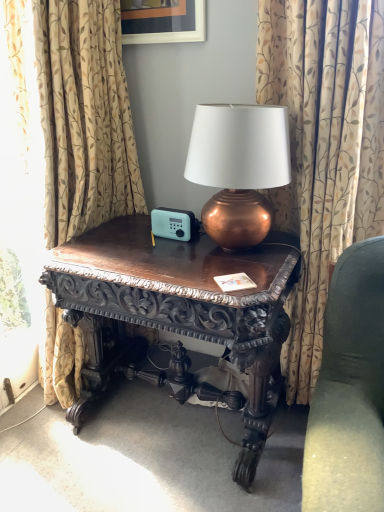
Image resolution: width=384 pixels, height=512 pixels. Describe the element at coordinates (239, 168) in the screenshot. I see `copper metallic lamp at center` at that location.

This screenshot has height=512, width=384. What do you see at coordinates (181, 305) in the screenshot?
I see `dark wood carved table at center` at bounding box center [181, 305].

This screenshot has width=384, height=512. I want to click on matte black picture frame at upper center, so click(x=163, y=21).

Which point is more distant from viewer, (358, 342) or (201, 27)?

The point (201, 27) is farther from the camera.

Which object is positioned more to the right, velvet green couch at right or matte black picture frame at upper center?

From the viewer's perspective, velvet green couch at right appears more on the right side.

Is velvet green couch at right oriented towards matte black picture frame at upper center?

No.

Does velvet green couch at right come in front of matte black picture frame at upper center?

Yes, velvet green couch at right is closer to the camera.

Which of these two, dark wood carved table at center or copper metallic lamp at center, stands taller?

With more height is dark wood carved table at center.

Which object is closer to the camera taking this photo, dark wood carved table at center or copper metallic lamp at center?

dark wood carved table at center is closer to the camera.

In the image, is dark wood carved table at center on the left side or the right side of copper metallic lamp at center?

dark wood carved table at center is positioned on copper metallic lamp at center's left side.

Between dark wood carved table at center and copper metallic lamp at center, which one has larger width?

dark wood carved table at center.

In the image, there is a copper metallic lamp at center. Identify the location of picture frame above it (from the image's perspective). The height and width of the screenshot is (512, 384). (163, 21).

Which object is positioned more to the left, copper metallic lamp at center or matte black picture frame at upper center?

Positioned to the left is matte black picture frame at upper center.

Considering the sizes of objects copper metallic lamp at center and matte black picture frame at upper center in the image provided, who is thinner, copper metallic lamp at center or matte black picture frame at upper center?

With smaller width is matte black picture frame at upper center.

Can you confirm if copper metallic lamp at center is taller than matte black picture frame at upper center?

Correct, copper metallic lamp at center is much taller as matte black picture frame at upper center.

Between matte black picture frame at upper center and copper metallic lamp at center, which one is positioned behind?

matte black picture frame at upper center is more distant.

Is matte black picture frame at upper center facing towards copper metallic lamp at center?

No, matte black picture frame at upper center is not aimed at copper metallic lamp at center.

Can you confirm if matte black picture frame at upper center is shorter than copper metallic lamp at center?

Correct, matte black picture frame at upper center is not as tall as copper metallic lamp at center.

In the image, there is a matte black picture frame at upper center. Identify the location of lamp below it (from the image's perspective). (239, 168).

Measure the distance from patterned fabric curtain at center, the second curtain when ordered from left to right, to dark wood carved table at center.

A distance of 16.06 inches exists between patterned fabric curtain at center, the second curtain when ordered from left to right, and dark wood carved table at center.

Is patterned fabric curtain at center, the 1th curtain in the right-to-left sequence, not close to dark wood carved table at center?

That's not correct — patterned fabric curtain at center, the 1th curtain in the right-to-left sequence, is a little close to dark wood carved table at center.

Is patterned fabric curtain at center, the 1th curtain in the right-to-left sequence, oriented away from dark wood carved table at center?

No, dark wood carved table at center is not at the back of patterned fabric curtain at center, the 1th curtain in the right-to-left sequence.

Considering the relative sizes of patterned fabric curtain at center, the second curtain when ordered from left to right, and dark wood carved table at center in the image provided, is patterned fabric curtain at center, the second curtain when ordered from left to right, bigger than dark wood carved table at center?

No, patterned fabric curtain at center, the second curtain when ordered from left to right, is not bigger than dark wood carved table at center.

Looking at this image, is beige floral fabric curtain at left, which appears as the 1th curtain when viewed from the left, touching copper metallic lamp at center?

beige floral fabric curtain at left, which appears as the 1th curtain when viewed from the left, and copper metallic lamp at center are not in contact.

From the image's perspective, is beige floral fabric curtain at left, acting as the second curtain starting from the right, above copper metallic lamp at center?

Actually, beige floral fabric curtain at left, acting as the second curtain starting from the right, appears below copper metallic lamp at center in the image.

Consider the image. Is beige floral fabric curtain at left, acting as the second curtain starting from the right, aimed at copper metallic lamp at center?

Yes, beige floral fabric curtain at left, acting as the second curtain starting from the right, is oriented towards copper metallic lamp at center.

Can you confirm if beige floral fabric curtain at left, acting as the second curtain starting from the right, is wider than copper metallic lamp at center?

No.

In the scene shown: Is patterned fabric curtain at center, the 1th curtain in the right-to-left sequence, not close to velvet green couch at right?

patterned fabric curtain at center, the 1th curtain in the right-to-left sequence, is near velvet green couch at right, not far away.

Considering the relative positions of patterned fabric curtain at center, the 1th curtain in the right-to-left sequence, and velvet green couch at right in the image provided, is patterned fabric curtain at center, the 1th curtain in the right-to-left sequence, in front of velvet green couch at right?

No, the depth of patterned fabric curtain at center, the 1th curtain in the right-to-left sequence, is greater than that of velvet green couch at right.

Considering the relative positions of patterned fabric curtain at center, the second curtain when ordered from left to right, and velvet green couch at right in the image provided, is patterned fabric curtain at center, the second curtain when ordered from left to right, to the left of velvet green couch at right from the viewer's perspective?

Correct, you'll find patterned fabric curtain at center, the second curtain when ordered from left to right, to the left of velvet green couch at right.

Considering the sizes of objects patterned fabric curtain at center, the 1th curtain in the right-to-left sequence, and velvet green couch at right in the image provided, who is bigger, patterned fabric curtain at center, the 1th curtain in the right-to-left sequence, or velvet green couch at right?

velvet green couch at right is bigger.

The width and height of the screenshot is (384, 512). What are the coordinates of `studio couch that appears below the matte black picture frame at upper center (from the image's perspective)` in the screenshot? It's located at (349, 390).

Locate an element on the screen. The width and height of the screenshot is (384, 512). lamp behind the dark wood carved table at center is located at coordinates (239, 168).

From the image, which object appears to be farther from velvet green couch at right, matte black picture frame at upper center or beige floral fabric curtain at left, which appears as the 1th curtain when viewed from the left?

matte black picture frame at upper center is further to velvet green couch at right.

Estimate the real-world distances between objects in this image. Which object is further from copper metallic lamp at center, dark wood carved table at center or matte black picture frame at upper center?

matte black picture frame at upper center.

Which object lies nearer to the anchor point patterned fabric curtain at center, the second curtain when ordered from left to right, velvet green couch at right or beige floral fabric curtain at left, which appears as the 1th curtain when viewed from the left?

Based on the image, velvet green couch at right appears to be nearer to patterned fabric curtain at center, the second curtain when ordered from left to right.

Considering their positions, is patterned fabric curtain at center, the 1th curtain in the right-to-left sequence, positioned further to matte black picture frame at upper center than beige floral fabric curtain at left, which appears as the 1th curtain when viewed from the left?

patterned fabric curtain at center, the 1th curtain in the right-to-left sequence, lies further to matte black picture frame at upper center than the other object.

Which object lies nearer to the anchor point patterned fabric curtain at center, the 1th curtain in the right-to-left sequence, beige floral fabric curtain at left, acting as the second curtain starting from the right, or dark wood carved table at center?

dark wood carved table at center is positioned closer to the anchor patterned fabric curtain at center, the 1th curtain in the right-to-left sequence.

Looking at the image, which one is located further to copper metallic lamp at center, velvet green couch at right or matte black picture frame at upper center?

Based on the image, matte black picture frame at upper center appears to be further to copper metallic lamp at center.

Estimate the real-world distances between objects in this image. Which object is closer to beige floral fabric curtain at left, acting as the second curtain starting from the right, velvet green couch at right or matte black picture frame at upper center?

Based on the image, matte black picture frame at upper center appears to be nearer to beige floral fabric curtain at left, acting as the second curtain starting from the right.

Based on the photo, from the image, which object appears to be farther from dark wood carved table at center, matte black picture frame at upper center or copper metallic lamp at center?

matte black picture frame at upper center lies further to dark wood carved table at center than the other object.

This screenshot has height=512, width=384. I want to click on lamp between matte black picture frame at upper center and dark wood carved table at center in the vertical direction, so click(239, 168).

Image resolution: width=384 pixels, height=512 pixels. I want to click on table between copper metallic lamp at center and velvet green couch at right vertically, so click(181, 305).

Where is `table between beige floral fabric curtain at left, which appears as the 1th curtain when viewed from the left, and copper metallic lamp at center from left to right`? table between beige floral fabric curtain at left, which appears as the 1th curtain when viewed from the left, and copper metallic lamp at center from left to right is located at coordinates (181, 305).

Identify the location of curtain between beige floral fabric curtain at left, which appears as the 1th curtain when viewed from the left, and velvet green couch at right, in the horizontal direction. The image size is (384, 512). (324, 149).